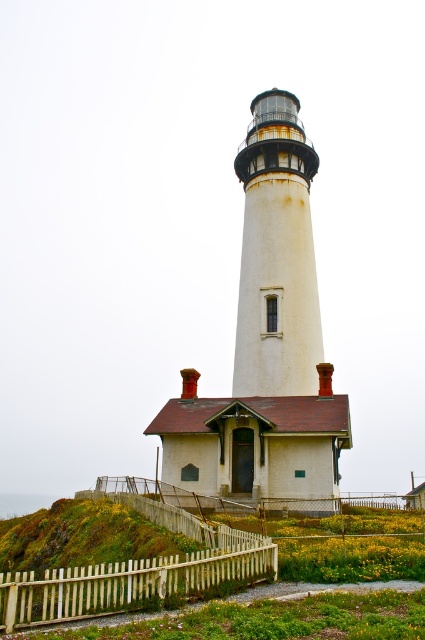
Question: Which point is closer to the camera?

Choices:
 (A) (244, 364)
 (B) (98, 605)

Answer: (B)

Question: Does white painted wood lighthouse at center have a lesser width compared to white wooden picket fence at lower center?

Choices:
 (A) no
 (B) yes

Answer: (A)

Question: Which object is the closest to the white textured lighthouse at center?

Choices:
 (A) green grass at lower center
 (B) white wooden picket fence at lower center
 (C) white painted wood lighthouse at center

Answer: (C)

Question: Is white painted wood lighthouse at center smaller than white wooden picket fence at lower center?

Choices:
 (A) yes
 (B) no

Answer: (B)

Question: Does white wooden picket fence at lower center have a smaller size compared to green grass at lower center?

Choices:
 (A) no
 (B) yes

Answer: (A)

Question: Which of the following is the closest to the observer?

Choices:
 (A) white textured lighthouse at center
 (B) white painted wood lighthouse at center
 (C) white wooden picket fence at lower center

Answer: (C)